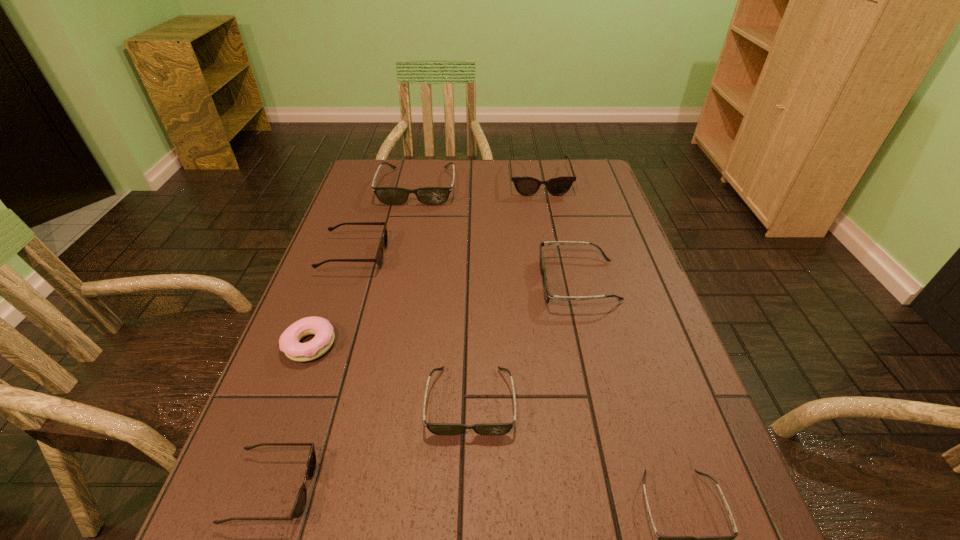
You are a GUI agent. You are given a task and a screenshot of the screen. Output one action in this format:
    pyautogui.click(x=<x>, y=<y>)
    Task: Click on the free spot between the second farthest black sunglasses and the farthest brown sunglasses
    
    Given the screenshot: What is the action you would take?
    click(559, 231)

The height and width of the screenshot is (540, 960). In order to click on free space that is in between the third nearest black sunglasses and the nearest brown sunglasses in this screenshot , I will do `click(425, 386)`.

You are a GUI agent. You are given a task and a screenshot of the screen. Output one action in this format:
    pyautogui.click(x=<x>, y=<y>)
    Task: Click on the unoccupied area between the nearest brown sunglasses and the biggest brown sunglasses
    
    Given the screenshot: What is the action you would take?
    406,334

Where is `free space between the third biggest black sunglasses and the third nearest black sunglasses`? The image size is (960, 540). free space between the third biggest black sunglasses and the third nearest black sunglasses is located at coordinates (524, 341).

The image size is (960, 540). In order to click on free space between the nearest brown sunglasses and the third nearest black sunglasses in this screenshot , I will do `click(425, 386)`.

What are the coordinates of `object that is the fifth closest to the second nearest brown sunglasses` in the screenshot? It's located at [x=526, y=186].

You are a GUI agent. You are given a task and a screenshot of the screen. Output one action in this format:
    pyautogui.click(x=<x>, y=<y>)
    Task: Click on the object that is the fourth nearest to the second nearest brown sunglasses
    This screenshot has height=540, width=960.
    Given the screenshot: What is the action you would take?
    pyautogui.click(x=548, y=296)

Locate an element on the screen. the closest sunglasses to the third farthest black sunglasses is located at coordinates [x=300, y=503].

The height and width of the screenshot is (540, 960). In order to click on the fifth closest sunglasses to the second smallest brown sunglasses in this screenshot , I will do `click(300, 503)`.

Identify the location of the third closest brown sunglasses to the biggest black sunglasses. This screenshot has height=540, width=960. (300, 503).